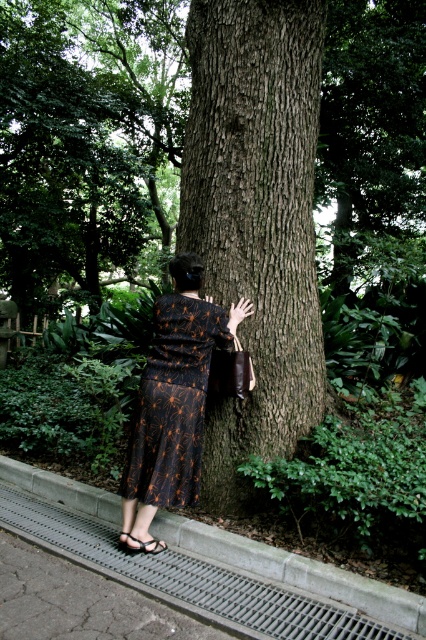
Who is positioned more to the right, brown rough bark at center or gray concrete curb at lower left?

brown rough bark at center is more to the right.

Between brown rough bark at center and gray concrete curb at lower left, which one has less height?

gray concrete curb at lower left

At what (x,y) coordinates should I click in order to perform the action: click on brown rough bark at center. Please return your answer as a coordinate pair (x, y). This screenshot has width=426, height=640. Looking at the image, I should click on (256, 218).

Can you confirm if gray concrete curb at lower left is thinner than black textured dress at center?

In fact, gray concrete curb at lower left might be wider than black textured dress at center.

Is gray concrete curb at lower left further to camera compared to black textured dress at center?

No, gray concrete curb at lower left is closer to the viewer.

Is point (244, 573) positioned in front of point (143, 493)?

That is True.

At what (x,y) coordinates should I click in order to perform the action: click on gray concrete curb at lower left. Please return your answer as a coordinate pair (x, y). Image resolution: width=426 pixels, height=640 pixels. Looking at the image, I should click on (209, 566).

Is point (218, 124) less distant than point (123, 474)?

No, it is behind (123, 474).

Can you confirm if brown rough bark at center is thinner than black textured dress at center?

In fact, brown rough bark at center might be wider than black textured dress at center.

You are a GUI agent. You are given a task and a screenshot of the screen. Output one action in this format:
    pyautogui.click(x=<x>, y=<y>)
    Task: Click on the brown rough bark at center
    
    Given the screenshot: What is the action you would take?
    pyautogui.click(x=256, y=218)